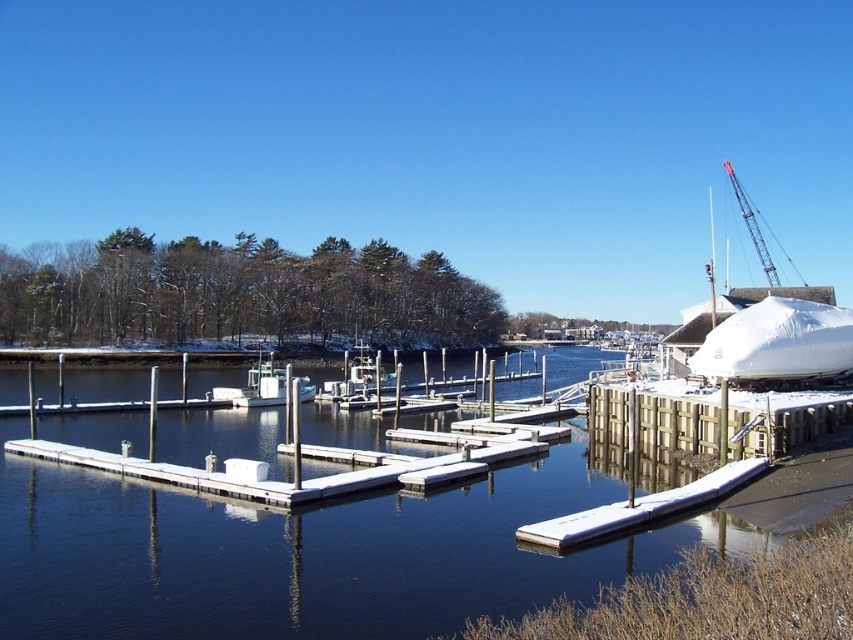
Who is lower down, clear water at dock center or wooden dock at lower right?

clear water at dock center is lower down.

Does clear water at dock center have a larger size compared to wooden dock at lower right?

Yes.

Where is `clear water at dock center`? This screenshot has width=853, height=640. clear water at dock center is located at coordinates (306, 554).

This screenshot has height=640, width=853. What are the coordinates of `clear water at dock center` in the screenshot? It's located at (306, 554).

Is wooden dock at lower right positioned before metallic gray crane at upper right?

That is True.

This screenshot has width=853, height=640. Identify the location of wooden dock at lower right. (712, 419).

Can you confirm if white matte boat at center is positioned above metallic gray crane at upper right?

Incorrect, white matte boat at center is not positioned above metallic gray crane at upper right.

Can you confirm if white matte boat at center is positioned to the right of metallic gray crane at upper right?

Incorrect, white matte boat at center is not on the right side of metallic gray crane at upper right.

Where is `white matte boat at center`? white matte boat at center is located at coordinates (264, 387).